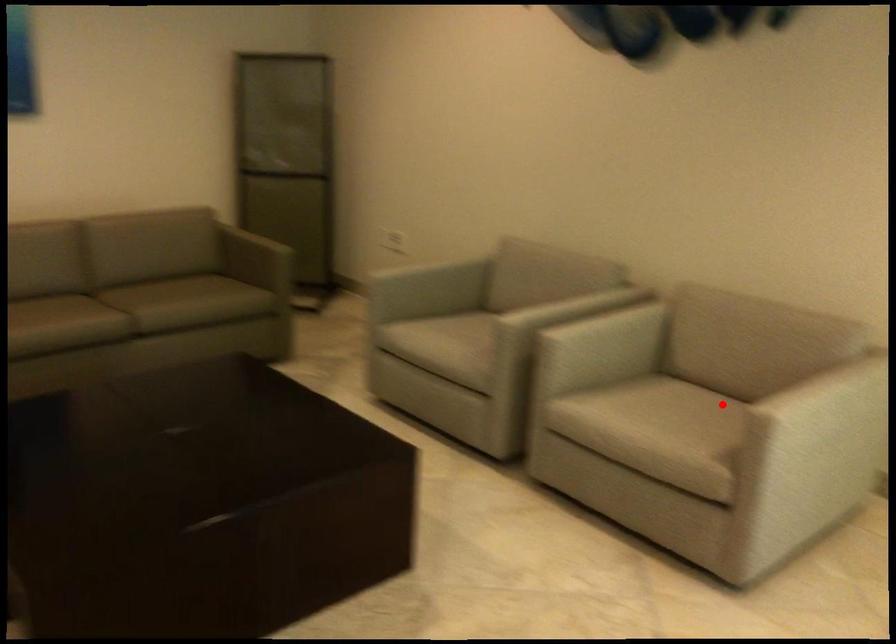
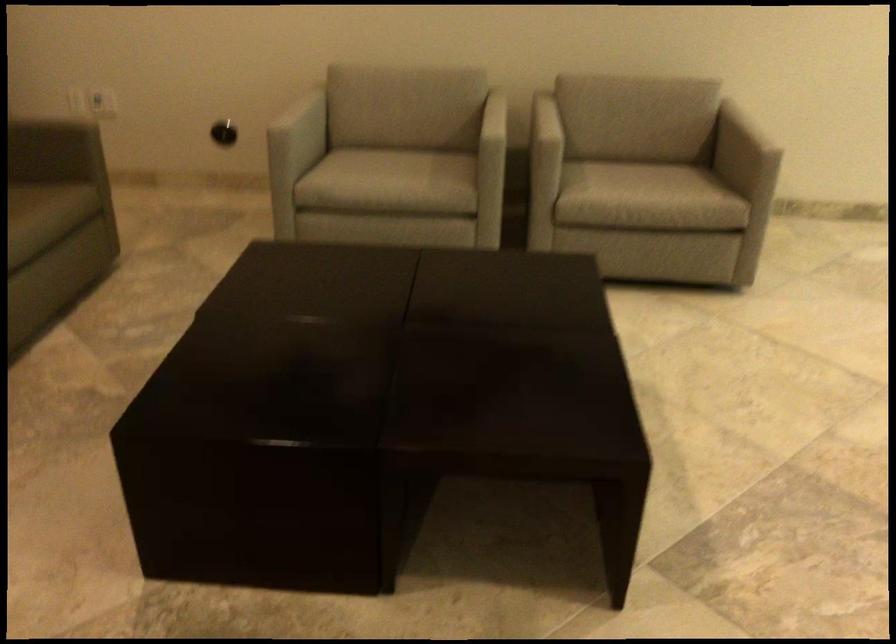
Question: I am providing you with two images of the same scene from different viewpoints. Image1 has a red point marked. In image2, the corresponding 3D location appears at what relative position? Reply with the corresponding letter.

Choices:
 (A) Closer
 (B) Farther

Answer: (B)